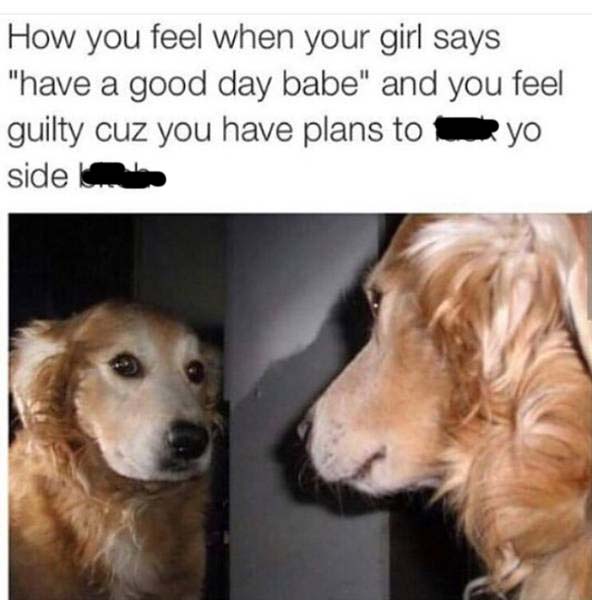
Identify the location of wall. Image resolution: width=592 pixels, height=600 pixels. (285, 492).